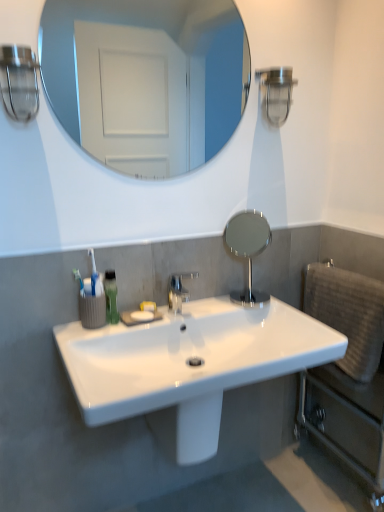
What is the approximate width of beige textured towel at right?

beige textured towel at right is 6.05 inches wide.

Measure the distance between white glossy sink at center and camera.

They are 3.37 feet apart.

The image size is (384, 512). What do you see at coordinates (248, 250) in the screenshot? I see `polished silver mirror at center, which is the 2th mirror from top to bottom` at bounding box center [248, 250].

Locate an element on the screen. The height and width of the screenshot is (512, 384). clear glass mirror at upper center, arranged as the 1th mirror when viewed from the left is located at coordinates (146, 79).

The width and height of the screenshot is (384, 512). I want to click on beige textured towel at right, so click(347, 362).

Considering the relative positions of white glossy sink at center and polished chrome faucet at center in the image provided, is white glossy sink at center to the left of polished chrome faucet at center from the viewer's perspective?

In fact, white glossy sink at center is to the right of polished chrome faucet at center.

How much distance is there between white glossy sink at center and polished chrome faucet at center?

white glossy sink at center is 34.51 centimeters away from polished chrome faucet at center.

Which of these two, white glossy sink at center or polished chrome faucet at center, stands taller?

Standing taller between the two is polished chrome faucet at center.

Can you confirm if white glossy sink at center is wider than polished chrome faucet at center?

Indeed, white glossy sink at center has a greater width compared to polished chrome faucet at center.

This screenshot has height=512, width=384. What are the coordinates of `swivel chair below the white glossy sink at center (from the image's perspective)` in the screenshot? It's located at (347, 362).

Does beige textured towel at right lie behind white glossy sink at center?

Yes.

Is point (371, 297) closer to camera compared to point (108, 355)?

No, (371, 297) is behind (108, 355).

In the scene shown: Based on their sizes in the image, would you say beige textured towel at right is bigger or smaller than white glossy sink at center?

Considering their sizes, beige textured towel at right takes up more space than white glossy sink at center.

Is clear glass light fixture at upper left at the back of clear glass mirror at upper center, the 2th mirror in the bottom-to-top sequence?

clear glass mirror at upper center, the 2th mirror in the bottom-to-top sequence, does not have its back to clear glass light fixture at upper left.

Considering the sizes of objects clear glass mirror at upper center, the 1th mirror positioned from the top, and clear glass light fixture at upper left in the image provided, who is smaller, clear glass mirror at upper center, the 1th mirror positioned from the top, or clear glass light fixture at upper left?

With smaller size is clear glass light fixture at upper left.

From a real-world perspective, does clear glass mirror at upper center, the second mirror when ordered from right to left, sit lower than clear glass light fixture at upper left?

No.

Is the surface of clear glass mirror at upper center, the 2th mirror in the bottom-to-top sequence, in direct contact with clear glass light fixture at upper left?

No, clear glass mirror at upper center, the 2th mirror in the bottom-to-top sequence, is not making contact with clear glass light fixture at upper left.

Who is bigger, clear glass mirror at upper center, the 2th mirror in the bottom-to-top sequence, or polished chrome faucet at center?

clear glass mirror at upper center, the 2th mirror in the bottom-to-top sequence.

Looking at their sizes, would you say clear glass mirror at upper center, the 1th mirror positioned from the top, is wider or thinner than polished chrome faucet at center?

Clearly, clear glass mirror at upper center, the 1th mirror positioned from the top, has less width compared to polished chrome faucet at center.

Would you say polished chrome faucet at center is part of clear glass mirror at upper center, the second mirror when ordered from right to left,'s contents?

No, polished chrome faucet at center is located outside of clear glass mirror at upper center, the second mirror when ordered from right to left.

Is clear glass mirror at upper center, the 1th mirror positioned from the top, taller than polished chrome faucet at center?

Yes, clear glass mirror at upper center, the 1th mirror positioned from the top, is taller than polished chrome faucet at center.

From a real-world perspective, which is physically above, polished silver mirror at center, which is the 2th mirror from top to bottom, or white glossy sink at center?

polished silver mirror at center, which is the 2th mirror from top to bottom.

Can you confirm if polished silver mirror at center, the second mirror viewed from the left, is smaller than white glossy sink at center?

Yes.

Between polished silver mirror at center, which is the 2th mirror from top to bottom, and white glossy sink at center, which one is positioned behind?

Positioned behind is polished silver mirror at center, which is the 2th mirror from top to bottom.

I want to click on swivel chair directly beneath the clear glass light fixture at upper left (from a real-world perspective), so click(x=347, y=362).

Does clear glass light fixture at upper left appear on the left side of beige textured towel at right?

Correct, you'll find clear glass light fixture at upper left to the left of beige textured towel at right.

In terms of height, does clear glass light fixture at upper left look taller or shorter compared to beige textured towel at right?

Considering their sizes, clear glass light fixture at upper left has less height than beige textured towel at right.

Is clear glass light fixture at upper left not near beige textured towel at right?

Yes, clear glass light fixture at upper left and beige textured towel at right are quite far apart.

Considering the positions of objects polished silver mirror at center, the second mirror viewed from the left, and polished chrome faucet at center in the image provided, who is more to the left, polished silver mirror at center, the second mirror viewed from the left, or polished chrome faucet at center?

Positioned to the left is polished chrome faucet at center.

Is polished silver mirror at center, the 1th mirror from the bottom, positioned beyond the bounds of polished chrome faucet at center?

Yes, polished silver mirror at center, the 1th mirror from the bottom, is outside of polished chrome faucet at center.

Are polished silver mirror at center, acting as the 1th mirror starting from the right, and polished chrome faucet at center located far from each other?

No, polished silver mirror at center, acting as the 1th mirror starting from the right, is not far away from polished chrome faucet at center.

Which object is closer to the camera, polished silver mirror at center, the second mirror viewed from the left, or polished chrome faucet at center?

polished chrome faucet at center.

This screenshot has height=512, width=384. In order to click on sink below the polished chrome faucet at center (from the image's perspective) in this screenshot , I will do `click(190, 362)`.

At what (x,y) coordinates should I click in order to perform the action: click on sink in front of the beige textured towel at right. Please return your answer as a coordinate pair (x, y). Looking at the image, I should click on (190, 362).

Consider the image. From the image, which object appears to be nearer to green matte mouthwash at lower left, clear glass mirror at upper center, the 2th mirror in the bottom-to-top sequence, or beige textured towel at right?

beige textured towel at right is positioned closer to the anchor green matte mouthwash at lower left.

From the image, which object appears to be nearer to beige textured towel at right, polished silver mirror at center, acting as the 1th mirror starting from the right, or clear glass light fixture at upper left?

Based on the image, polished silver mirror at center, acting as the 1th mirror starting from the right, appears to be nearer to beige textured towel at right.

Looking at the image, which one is located closer to polished chrome faucet at center, polished silver mirror at center, the second mirror viewed from the left, or clear glass mirror at upper center, the second mirror when ordered from right to left?

Based on the image, polished silver mirror at center, the second mirror viewed from the left, appears to be nearer to polished chrome faucet at center.

Estimate the real-world distances between objects in this image. Which object is closer to green matte mouthwash at lower left, clear glass light fixture at upper left or polished silver mirror at center, acting as the 1th mirror starting from the right?

Among the two, polished silver mirror at center, acting as the 1th mirror starting from the right, is located nearer to green matte mouthwash at lower left.

Considering their positions, is green matte mouthwash at lower left positioned closer to beige textured towel at right than polished chrome faucet at center?

polished chrome faucet at center is positioned closer to the anchor beige textured towel at right.

When comparing their distances from polished chrome faucet at center, does green matte mouthwash at lower left or clear glass light fixture at upper left seem further?

The object further to polished chrome faucet at center is clear glass light fixture at upper left.

Looking at the image, which one is located further to polished chrome faucet at center, green matte mouthwash at lower left or clear glass mirror at upper center, the second mirror when ordered from right to left?

clear glass mirror at upper center, the second mirror when ordered from right to left, is positioned further to the anchor polished chrome faucet at center.

When comparing their distances from beige textured towel at right, does clear glass light fixture at upper left or clear glass mirror at upper center, the 1th mirror positioned from the top, seem closer?

clear glass light fixture at upper left.

Where is `mouthwash between clear glass mirror at upper center, the second mirror when ordered from right to left, and white glossy sink at center vertically`? mouthwash between clear glass mirror at upper center, the second mirror when ordered from right to left, and white glossy sink at center vertically is located at coordinates (111, 297).

The height and width of the screenshot is (512, 384). What are the coordinates of `tap between clear glass light fixture at upper left and white glossy sink at center from top to bottom` in the screenshot? It's located at (178, 290).

This screenshot has height=512, width=384. What are the coordinates of `mirror located between white glossy sink at center and beige textured towel at right in the left-right direction` in the screenshot? It's located at (248, 250).

The width and height of the screenshot is (384, 512). In order to click on light fixture between clear glass mirror at upper center, the second mirror when ordered from right to left, and beige textured towel at right, in the vertical direction in this screenshot , I will do `click(19, 81)`.